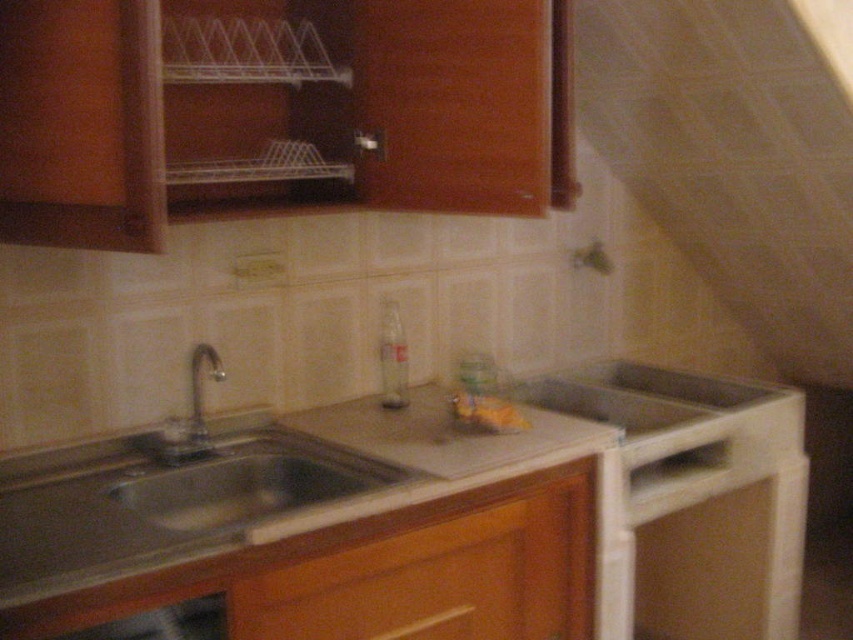
Question: Based on their relative distances, which object is nearer to the white matte exhaust hood at upper right?

Choices:
 (A) smooth white countertop at center
 (B) wooden drawer at lower center
 (C) silver metallic faucet at sink left

Answer: (A)

Question: Is smooth white countertop at center positioned at the back of wooden drawer at lower center?

Choices:
 (A) no
 (B) yes

Answer: (A)

Question: Which point is farther to the camera?

Choices:
 (A) (222, 465)
 (B) (485, 580)
 (C) (759, 148)

Answer: (C)

Question: Observing the image, what is the correct spatial positioning of smooth white countertop at center in reference to silver metallic faucet at sink left?

Choices:
 (A) below
 (B) above

Answer: (A)

Question: Can you confirm if white matte exhaust hood at upper right is positioned to the right of silver metallic faucet at sink left?

Choices:
 (A) yes
 (B) no

Answer: (A)

Question: Which point is farther to the camera?

Choices:
 (A) smooth white countertop at center
 (B) wooden drawer at lower center
 (C) silver metallic faucet at sink left
 (D) white matte exhaust hood at upper right

Answer: (C)